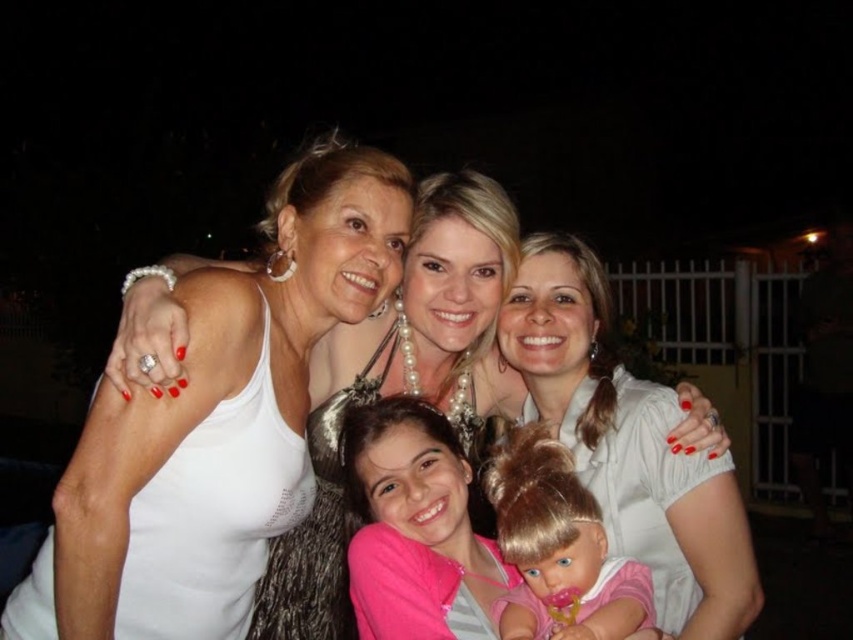
Question: Which of the following is the closest to the observer?

Choices:
 (A) (299, 577)
 (B) (589, 536)

Answer: (B)

Question: Can you confirm if white pearl necklace at center is wider than white satin blouse at center?

Choices:
 (A) no
 (B) yes

Answer: (B)

Question: Among these objects, which one is farthest from the camera?

Choices:
 (A) white fabric dress at upper left
 (B) white satin blouse at center

Answer: (B)

Question: From the image, what is the correct spatial relationship of smooth plastic doll at center in relation to sparkly silver dress at center?

Choices:
 (A) left
 (B) right

Answer: (B)

Question: Which of these objects is positioned closest to the sparkly silver dress at center?

Choices:
 (A) white fabric dress at upper left
 (B) smooth plastic doll at center
 (C) white pearl necklace at center

Answer: (C)

Question: Can you confirm if smooth plastic doll at center is positioned above sparkly silver dress at center?

Choices:
 (A) yes
 (B) no

Answer: (B)